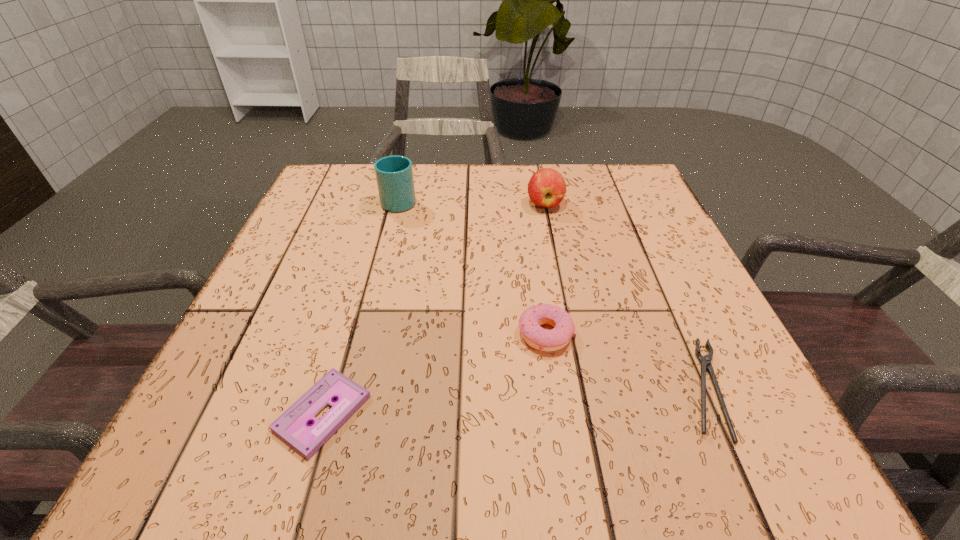
Locate an element on the screen. The width and height of the screenshot is (960, 540). free point at the left edge is located at coordinates (318, 234).

Where is `free location at the right edge of the desktop`? free location at the right edge of the desktop is located at coordinates (664, 318).

Locate an element on the screen. Image resolution: width=960 pixels, height=540 pixels. vacant space at the far right corner is located at coordinates (628, 196).

This screenshot has width=960, height=540. Find the location of `vacant area that lies between the fourth shortest object and the rightmost object`. vacant area that lies between the fourth shortest object and the rightmost object is located at coordinates (625, 296).

Locate an element on the screen. The width and height of the screenshot is (960, 540). free space between the third tallest object and the second tallest object is located at coordinates pyautogui.click(x=545, y=269).

The image size is (960, 540). What are the coordinates of `empty space between the cup and the rightmost object` in the screenshot? It's located at (552, 294).

Identify the location of free spot between the tongs and the second tallest object. (625, 296).

Where is `empty location between the cup and the fourth shortest object`? empty location between the cup and the fourth shortest object is located at coordinates (472, 202).

Find the location of `blank region between the tallest object and the videotape`. blank region between the tallest object and the videotape is located at coordinates (361, 307).

I want to click on empty space that is in between the shortest object and the fourth shortest object, so point(434,308).